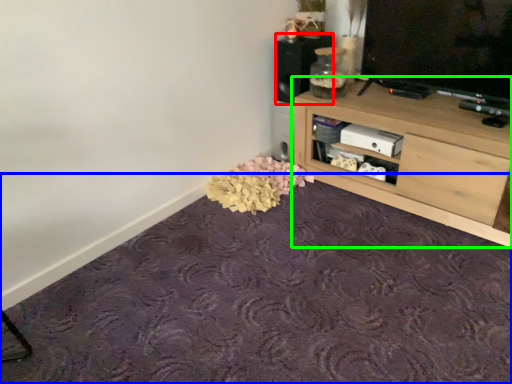
Question: Which is farther away from speaker (highlighted by a red box)? plain (highlighted by a blue box) or shelf (highlighted by a green box)?

Choices:
 (A) plain
 (B) shelf

Answer: (A)